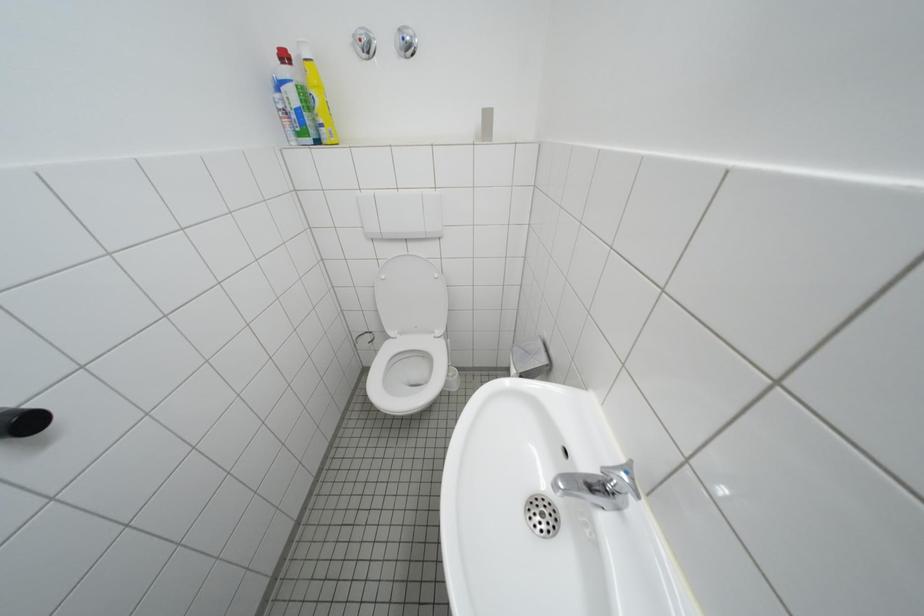
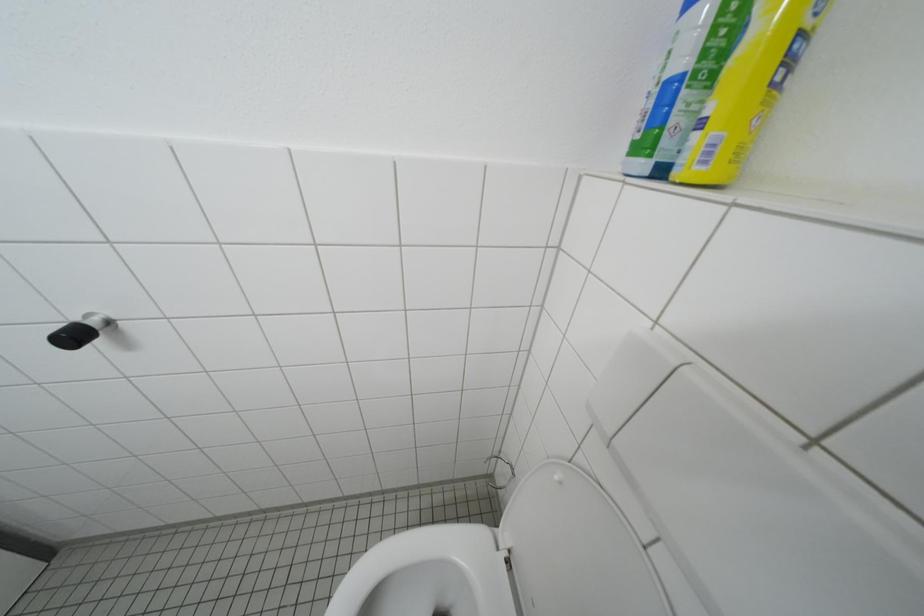
First-person continuous shooting, in which direction is the camera rotating?

The rotation direction of the camera is left-down.